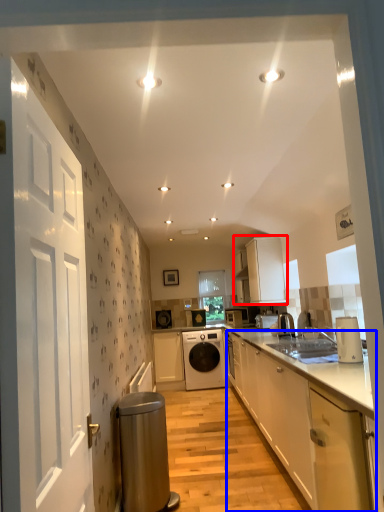
Question: Among these objects, which one is nearest to the camera, cabinetry (highlighted by a red box) or cabinetry (highlighted by a blue box)?

Choices:
 (A) cabinetry
 (B) cabinetry

Answer: (B)